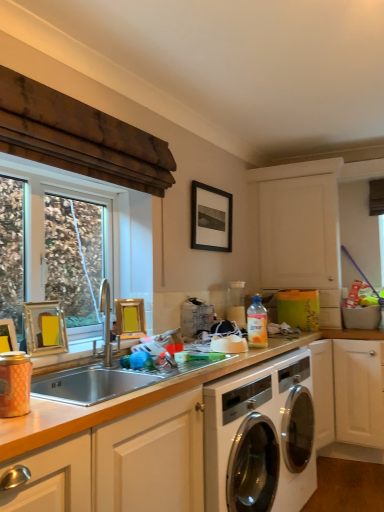
Question: Choose the correct answer: Is black matte picture frame at upper center, arranged as the fourth picture frame when ordered from the bottom, inside matte pink canister at left or outside it?

Choices:
 (A) outside
 (B) inside

Answer: (A)

Question: Is black matte picture frame at upper center, arranged as the fourth picture frame when ordered from the bottom, wider or thinner than matte pink canister at left?

Choices:
 (A) wide
 (B) thin

Answer: (B)

Question: Estimate the real-world distances between objects in this image. Which object is farther from the translucent plastic bottle at center?

Choices:
 (A) matte pink canister at left
 (B) clear glass window at left
 (C) silver metallic sink at center
 (D) yellow matte picture frame at sink, which appears as the second picture frame when viewed from the right
 (E) gold metallic picture frame at left, acting as the first picture frame starting from the front

Answer: (A)

Question: Based on their relative distances, which object is nearer to the matte pink canister at left?

Choices:
 (A) translucent plastic bottle at center
 (B) yellow matte picture frame at sink, which is counted as the third picture frame, starting from the left
 (C) gold metallic picture frame at left, the 2th picture frame when ordered from front to back
 (D) clear glass window at left
 (E) gold metallic picture frame at left, which appears as the second picture frame when ordered from the bottom

Answer: (E)